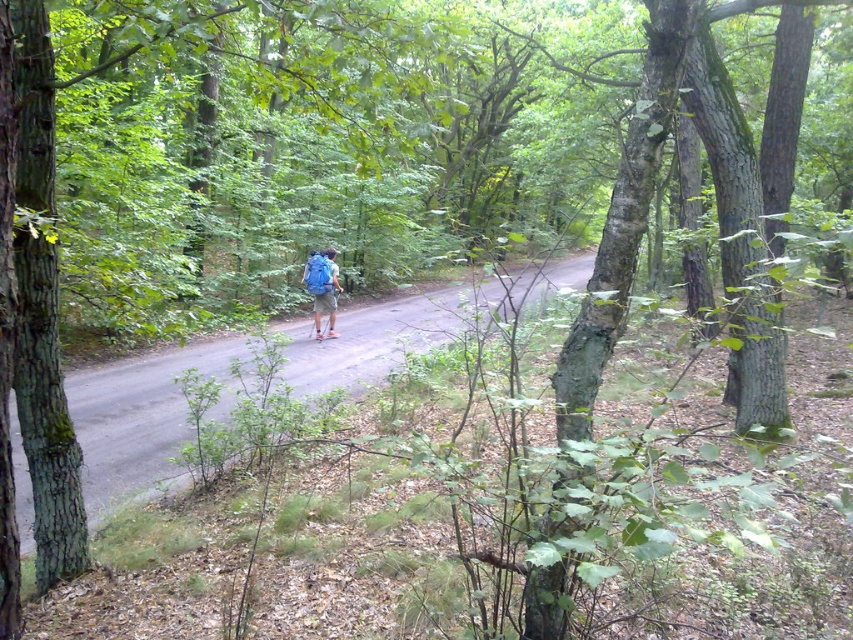
You are a delivery drone flying at an altitude of 10 meters above the ground. You need to land on the smooth asphalt road at center. Can you safely descend vertically to land on it?

The smooth asphalt road at center is 5.50 meters from camera, so yes, the drone can safely descend vertically to land on it since the altitude is sufficient.

Based on the photo, you are a hiker who wants to place your blue fabric backpack at center on the ground. Given that the smooth asphalt road at center is in front of the backpack, where should you position the backpack to ensure it is not on the road?

The smooth asphalt road at center is in front of the blue fabric backpack at center, so to keep the backpack off the road, you should place it behind the road, away from the path.

You are a hiker planning to place your blue fabric backpack at center on the smooth asphalt road at center. Can the backpack fit on the road without hanging off the edge?

The smooth asphalt road at center has a greater height compared to blue fabric backpack at center, so the backpack will fit on the road without hanging off the edge since the road is taller than the backpack.